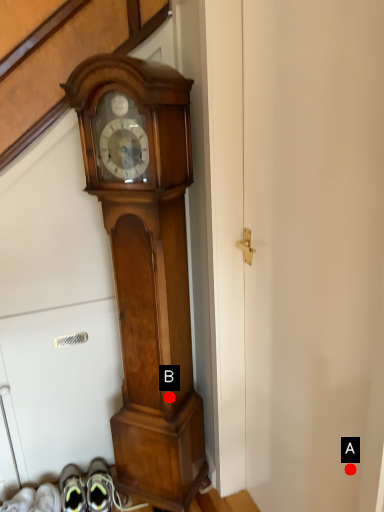
Question: Two points are circled on the image, labeled by A and B beside each circle. Among these points, which one is farthest from the camera?

Choices:
 (A) A is further
 (B) B is further

Answer: (B)